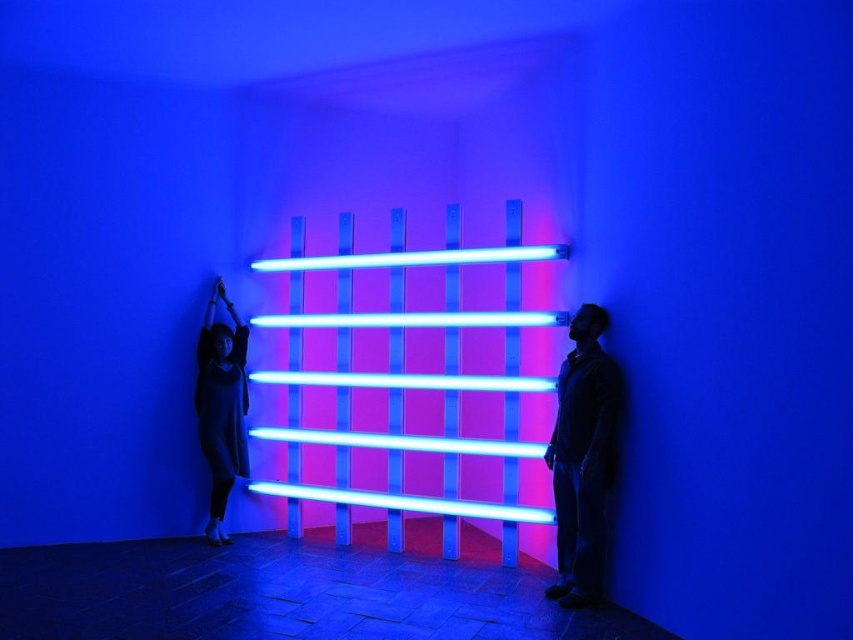
You are organizing a fashion show and need to place the matte black shirt at right and the matte black dress at left in the correct order. According to the scene, which item should be positioned to the right of the other?

According to the scene, the matte black shirt at right is to the right of the matte black dress at left, so the shirt should be placed to the right of the dress.

You are attending an event in this blue lit room and notice two people wearing matte black attire. One is wearing a matte black shirt at right and the other a matte black dress at left. Based on their clothing, which person is shorter in height?

The matte black shirt at right has a lesser height compared to the matte black dress at left, so the person wearing the matte black shirt at right is shorter.

In the scene shown: You are organizing a fashion show and need to display two outfits side by side. The matte black shirt at right and the matte black dress at left must be placed on mannequins. Given their sizes, which outfit requires a wider mannequin?

The matte black shirt at right requires a wider mannequin because its width is larger than the matte black dress at left.